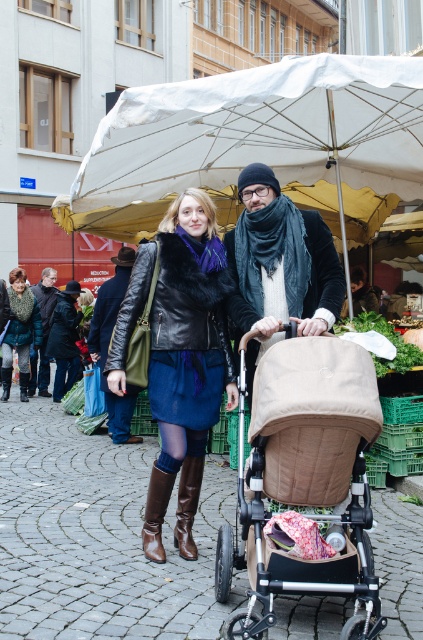
Question: Which object appears closest to the camera in this image?

Choices:
 (A) matte black leather jacket at center
 (B) beige fabric stroller at center

Answer: (B)

Question: Among these objects, which one is farthest from the camera?

Choices:
 (A) white fabric umbrella at upper center
 (B) knitted wool sweater at lower left
 (C) leather boots at lower center

Answer: (B)

Question: Based on their relative distances, which object is farther from the matte black leather jacket at center?

Choices:
 (A) white fabric umbrella at upper center
 (B) knitted wool sweater at lower left
 (C) beige fabric stroller at center
 (D) leather boots at lower center

Answer: (B)

Question: Does beige fabric stroller at center appear on the right side of matte black leather jacket at center?

Choices:
 (A) no
 (B) yes

Answer: (B)

Question: Is brown leather boot at lower center behind leather boots at lower center?

Choices:
 (A) yes
 (B) no

Answer: (A)

Question: Can you confirm if beige fabric stroller at center is positioned to the left of matte black leather jacket at center?

Choices:
 (A) yes
 (B) no

Answer: (B)